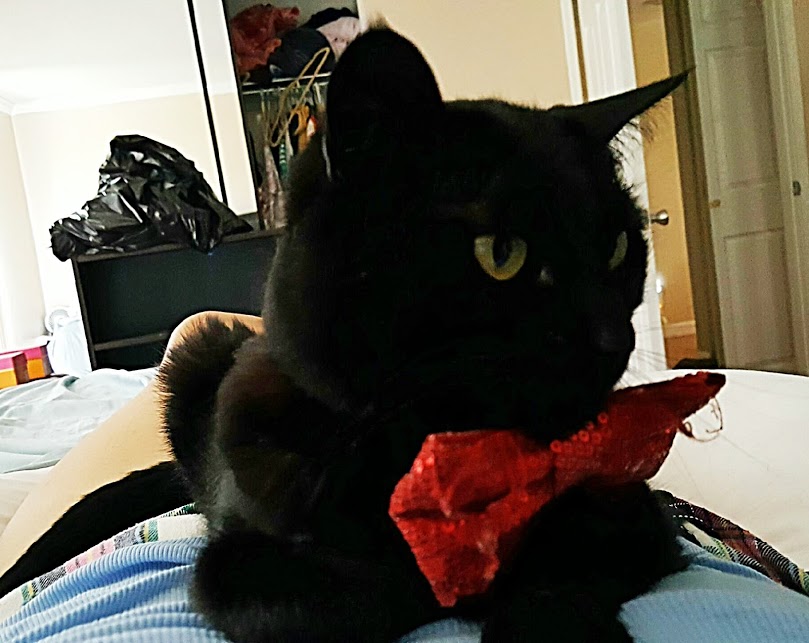
The width and height of the screenshot is (809, 643). I want to click on yellow wall, so click(x=489, y=39).